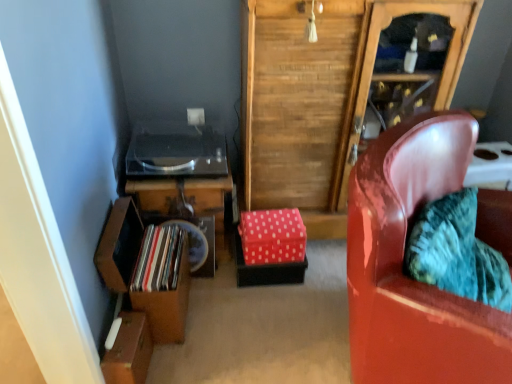
Question: Is wooden shelf at lower left turned away from shiny metallic record at left?

Choices:
 (A) yes
 (B) no

Answer: (A)

Question: Does wooden shelf at lower left appear on the left side of shiny metallic record at left?

Choices:
 (A) no
 (B) yes

Answer: (B)

Question: Is wooden shelf at lower left next to shiny metallic record at left?

Choices:
 (A) no
 (B) yes

Answer: (B)

Question: Is wooden shelf at lower left positioned in front of shiny metallic record at left?

Choices:
 (A) no
 (B) yes

Answer: (B)

Question: From a real-world perspective, is wooden shelf at lower left on shiny metallic record at left?

Choices:
 (A) yes
 (B) no

Answer: (B)

Question: Is wooden shelf at lower left to the right of shiny metallic record at left from the viewer's perspective?

Choices:
 (A) no
 (B) yes

Answer: (A)

Question: From the image's perspective, would you say wooden shelf at lower left is shown under wooden record player at lower left?

Choices:
 (A) no
 (B) yes

Answer: (B)

Question: Are wooden shelf at lower left and wooden record player at lower left located far from each other?

Choices:
 (A) yes
 (B) no

Answer: (B)

Question: Is wooden shelf at lower left taller than wooden record player at lower left?

Choices:
 (A) yes
 (B) no

Answer: (A)

Question: Considering the relative sizes of wooden shelf at lower left and wooden record player at lower left in the image provided, is wooden shelf at lower left wider than wooden record player at lower left?

Choices:
 (A) no
 (B) yes

Answer: (B)

Question: From a real-world perspective, is wooden shelf at lower left under wooden record player at lower left?

Choices:
 (A) yes
 (B) no

Answer: (A)

Question: Can you confirm if wooden shelf at lower left is bigger than wooden record player at lower left?

Choices:
 (A) no
 (B) yes

Answer: (B)

Question: From a real-world perspective, is red polka dot fabric box at center, which ranks as the first box in top-to-bottom order, beneath shiny metallic record at left?

Choices:
 (A) no
 (B) yes

Answer: (B)